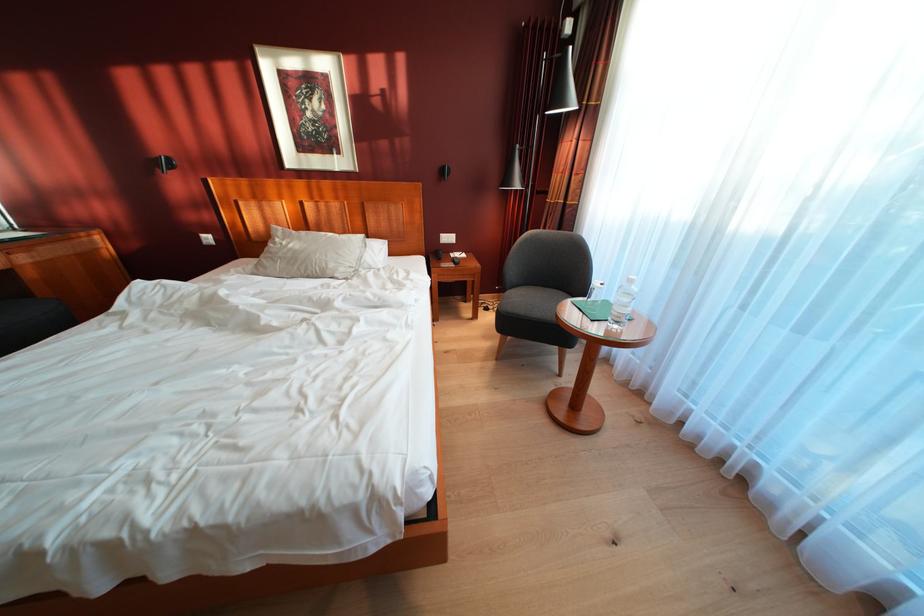
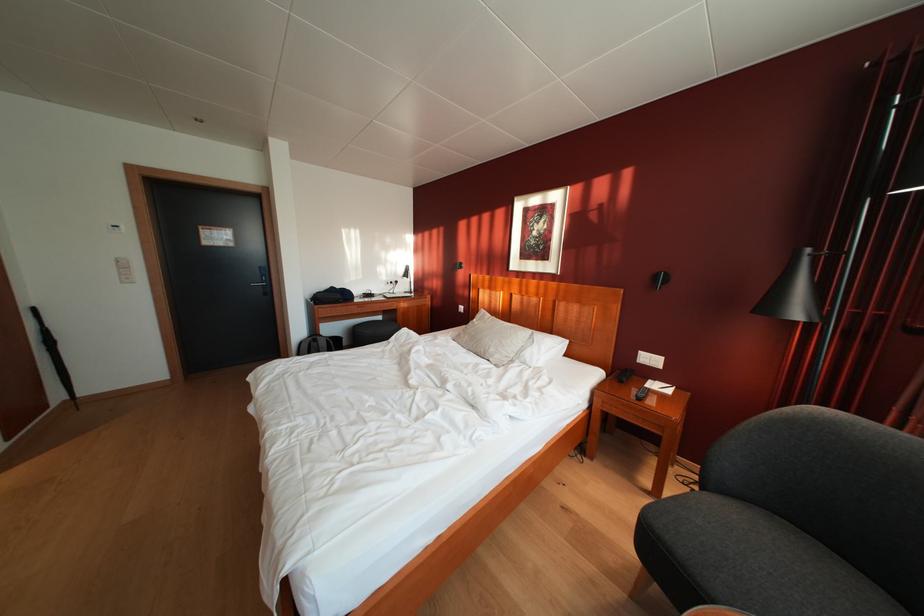
Question: The camera is either moving clockwise (left) or counter-clockwise (right) around the object. The first image is from the beginning of the video and the second image is from the end. Is the camera moving left or right when shooting the video?

Choices:
 (A) Left
 (B) Right

Answer: (B)